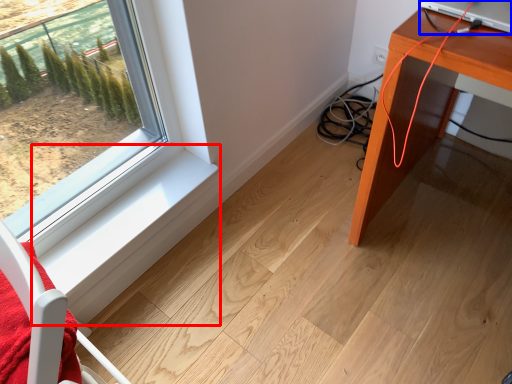
Question: Which of the following is the farthest to the observer, window sill (highlighted by a red box) or desktop computer (highlighted by a blue box)?

Choices:
 (A) window sill
 (B) desktop computer

Answer: (A)